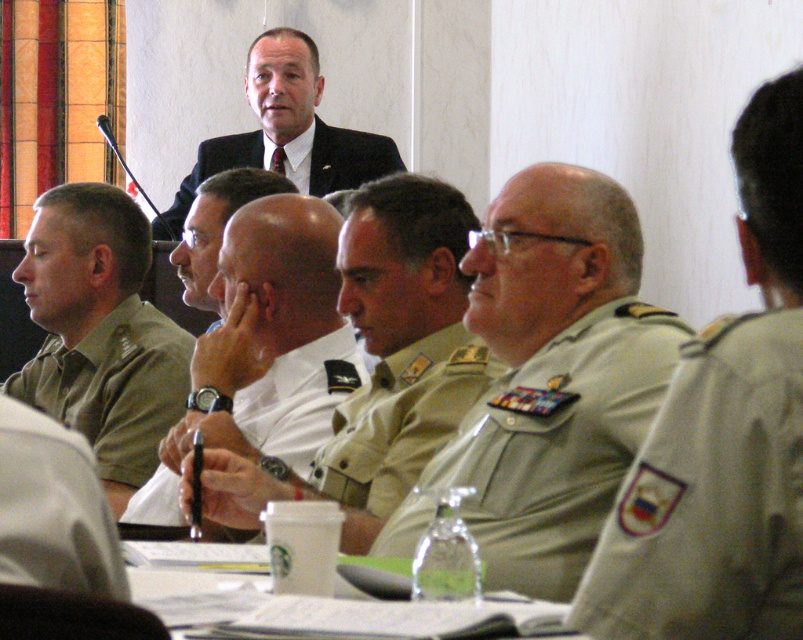
Question: Which point appears closest to the camera in this image?

Choices:
 (A) (316, 97)
 (B) (80, 269)
 (C) (628, 388)

Answer: (C)

Question: Estimate the real-world distances between objects in this image. Which object is closer to the white uniform at center?

Choices:
 (A) khaki uniform at center
 (B) khaki fabric uniform at center
 (C) white paper at center

Answer: (A)

Question: Can you confirm if green fabric uniform at right is bigger than light olive green fabric uniform at center?

Choices:
 (A) no
 (B) yes

Answer: (A)

Question: Is white uniform at center above khaki fabric uniform at center?

Choices:
 (A) yes
 (B) no

Answer: (A)

Question: Is green fabric uniform at right positioned behind khaki uniform at center?

Choices:
 (A) no
 (B) yes

Answer: (A)

Question: Estimate the real-world distances between objects in this image. Which object is farther from the green fabric uniform at right?

Choices:
 (A) white uniform at center
 (B) khaki fabric uniform at center

Answer: (A)